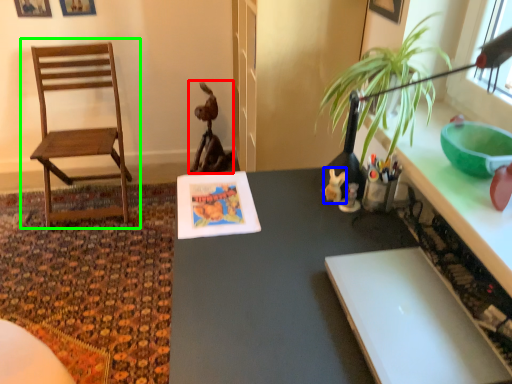
Question: Which object is positioned closest to animal (highlighted by a red box)? Select from toy (highlighted by a blue box) and chair (highlighted by a green box).

Choices:
 (A) toy
 (B) chair

Answer: (B)